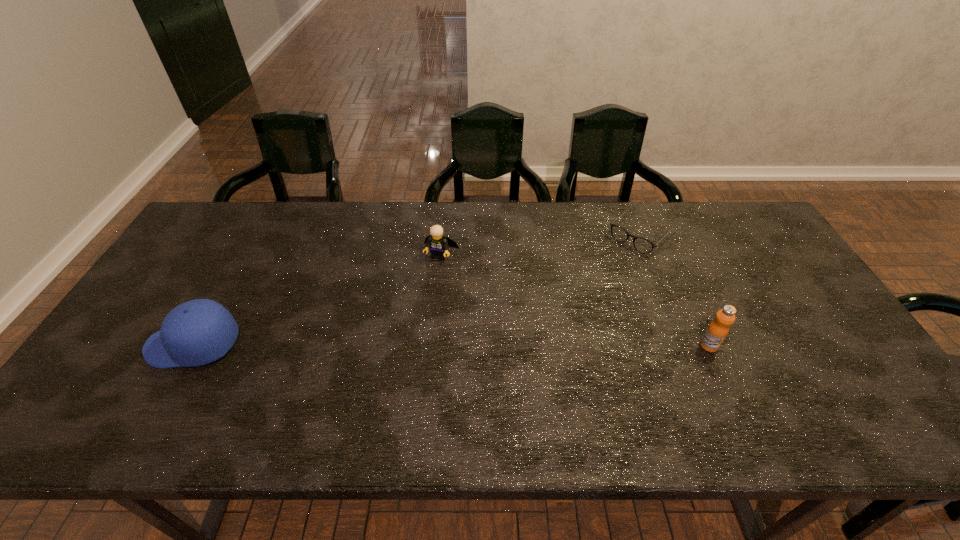
This screenshot has width=960, height=540. In order to click on the leftmost object in this screenshot , I will do `click(197, 332)`.

This screenshot has width=960, height=540. Find the location of `orange juice`. orange juice is located at coordinates (718, 329).

At what (x,y) coordinates should I click in order to perform the action: click on spectacles. Please return your answer as a coordinate pair (x, y). Looking at the image, I should click on (642, 245).

The image size is (960, 540). In order to click on Lego in this screenshot , I will do `click(438, 244)`.

Where is `free space located 0.080m on the front label of the orange juice`? The image size is (960, 540). free space located 0.080m on the front label of the orange juice is located at coordinates [x=725, y=380].

Where is `vacant region located 0.310m through the lenses of the shortest object`? vacant region located 0.310m through the lenses of the shortest object is located at coordinates pos(566,305).

In order to click on free space located through the lenses of the shortest object in this screenshot , I will do `click(583, 290)`.

Find the location of `vacant position located through the lenses of the shortest object`. vacant position located through the lenses of the shortest object is located at coordinates (564, 307).

You are a GUI agent. You are given a task and a screenshot of the screen. Output one action in this format:
    pyautogui.click(x=<x>, y=<y>)
    Task: Click on the free region located on the front-facing side of the Lego
    
    Given the screenshot: What is the action you would take?
    pyautogui.click(x=390, y=371)

Where is `free space located 0.100m on the front-facing side of the Lego`? The width and height of the screenshot is (960, 540). free space located 0.100m on the front-facing side of the Lego is located at coordinates (426, 287).